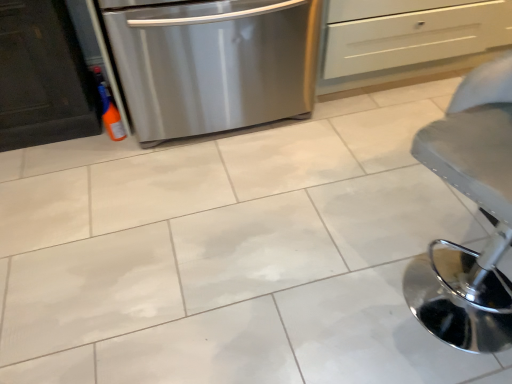
Question: Is white matte drawer at upper center far from metallic gray stool at lower right?

Choices:
 (A) no
 (B) yes

Answer: (B)

Question: Is metallic gray stool at lower right surrounded by white matte drawer at upper center?

Choices:
 (A) no
 (B) yes

Answer: (A)

Question: From the image's perspective, is white matte drawer at upper center located beneath metallic gray stool at lower right?

Choices:
 (A) no
 (B) yes

Answer: (A)

Question: Considering the relative sizes of white matte drawer at upper center and metallic gray stool at lower right in the image provided, is white matte drawer at upper center taller than metallic gray stool at lower right?

Choices:
 (A) yes
 (B) no

Answer: (B)

Question: Is white matte drawer at upper center closer to the viewer compared to metallic gray stool at lower right?

Choices:
 (A) no
 (B) yes

Answer: (A)

Question: From a real-world perspective, is white matte drawer at upper center located beneath metallic gray stool at lower right?

Choices:
 (A) yes
 (B) no

Answer: (A)

Question: Is metallic gray stool at lower right shorter than stainless steel dishwasher at left?

Choices:
 (A) yes
 (B) no

Answer: (B)

Question: From a real-world perspective, is metallic gray stool at lower right physically above stainless steel dishwasher at left?

Choices:
 (A) no
 (B) yes

Answer: (B)

Question: Does metallic gray stool at lower right have a greater height compared to stainless steel dishwasher at left?

Choices:
 (A) yes
 (B) no

Answer: (A)

Question: Considering the relative positions of metallic gray stool at lower right and stainless steel dishwasher at left in the image provided, is metallic gray stool at lower right to the left of stainless steel dishwasher at left from the viewer's perspective?

Choices:
 (A) yes
 (B) no

Answer: (B)

Question: Is metallic gray stool at lower right bigger than stainless steel dishwasher at left?

Choices:
 (A) no
 (B) yes

Answer: (A)

Question: Does metallic gray stool at lower right touch stainless steel dishwasher at left?

Choices:
 (A) no
 (B) yes

Answer: (A)

Question: Is metallic gray stool at lower right placed right next to white matte drawer at upper center?

Choices:
 (A) yes
 (B) no

Answer: (B)